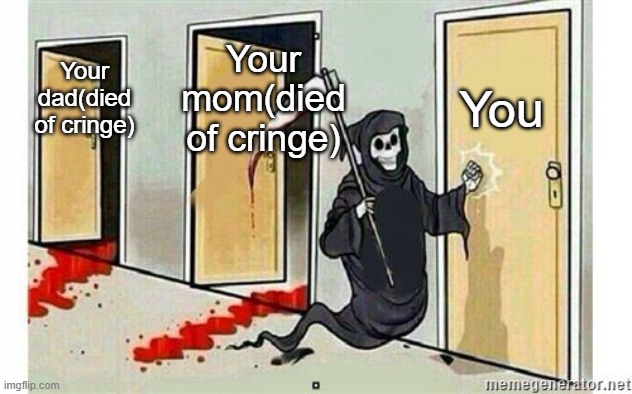
Find the location of a particular element. doors is located at coordinates (517, 281), (238, 221), (51, 180).